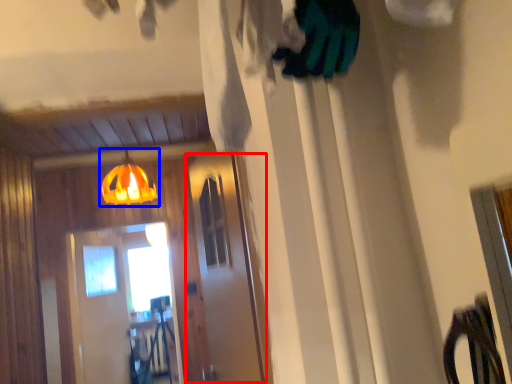
Question: Which of the following is the closest to the observer, screen door (highlighted by a red box) or lamp (highlighted by a blue box)?

Choices:
 (A) screen door
 (B) lamp

Answer: (A)